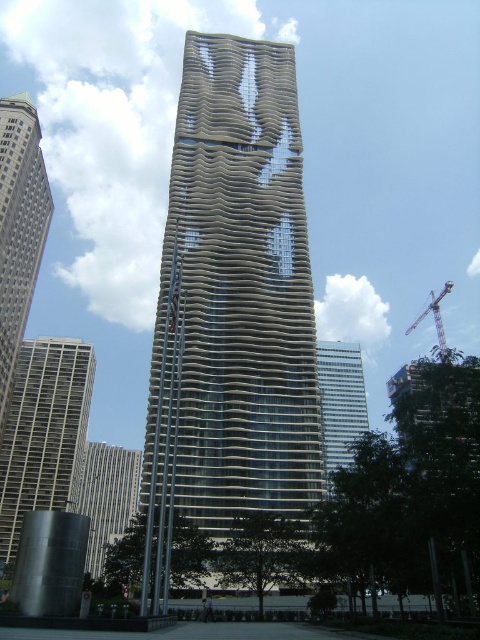
Can you confirm if gray concrete building at left is shorter than matte gray skyscraper at left?

Yes, gray concrete building at left is shorter than matte gray skyscraper at left.

Is point (60, 490) closer to viewer compared to point (0, 148)?

No, it is not.

Who is more forward, [14,420] or [25,227]?

Positioned in front is point [25,227].

Where is `gray concrete building at left`? The height and width of the screenshot is (640, 480). gray concrete building at left is located at coordinates (44, 433).

Does brown textured building at center have a greater height compared to gray concrete building at left?

Indeed, brown textured building at center has a greater height compared to gray concrete building at left.

Between point (192, 392) and point (75, 372), which one is positioned in front?

Positioned in front is point (192, 392).

Who is more forward, (227,449) or (19,476)?

Point (227,449) is in front.

At what (x,y) coordinates should I click in order to perform the action: click on brown textured building at center. Please return your answer as a coordinate pair (x, y). This screenshot has height=640, width=480. Looking at the image, I should click on (235, 300).

Which is above, white glass building at center or metallic gray crane at right?

Positioned higher is metallic gray crane at right.

Which is more to the left, white glass building at center or metallic gray crane at right?

From the viewer's perspective, white glass building at center appears more on the left side.

What do you see at coordinates (339, 403) in the screenshot?
I see `white glass building at center` at bounding box center [339, 403].

At what (x,y) coordinates should I click in order to perform the action: click on white glass building at center. Please return your answer as a coordinate pair (x, y). Looking at the image, I should click on (339, 403).